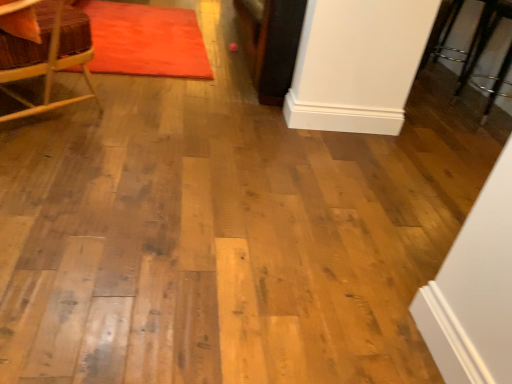
Measure the distance between point (x=28, y=61) and camera.

Point (x=28, y=61) and camera are 5.83 feet apart from each other.

What do you see at coordinates (46, 52) in the screenshot? This screenshot has height=384, width=512. I see `wooden chair at left` at bounding box center [46, 52].

You are a GUI agent. You are given a task and a screenshot of the screen. Output one action in this format:
    pyautogui.click(x=<x>, y=<y>)
    Task: Click on the wooden chair at left
    
    Given the screenshot: What is the action you would take?
    pyautogui.click(x=46, y=52)

This screenshot has height=384, width=512. What do you see at coordinates (146, 40) in the screenshot?
I see `velvet orange mat at upper left` at bounding box center [146, 40].

The height and width of the screenshot is (384, 512). Find the location of `velvet orange mat at upper left`. velvet orange mat at upper left is located at coordinates (146, 40).

Measure the distance between point (134, 63) and camera.

2.75 meters.

Where is `wooden chair at left`? The width and height of the screenshot is (512, 384). wooden chair at left is located at coordinates (46, 52).

Would you say wooden chair at left is to the left or to the right of velvet orange mat at upper left in the picture?

In the image, wooden chair at left appears on the left side of velvet orange mat at upper left.

Considering the relative positions of wooden chair at left and velvet orange mat at upper left in the image provided, is wooden chair at left behind velvet orange mat at upper left?

That is False.

Does point (83, 51) come farther from viewer compared to point (106, 59)?

No, it is in front of (106, 59).

From the image's perspective, is wooden chair at left positioned above or below velvet orange mat at upper left?

From the image's perspective, wooden chair at left appears below velvet orange mat at upper left.

From a real-world perspective, which object stands above the other?

wooden chair at left, from a real-world perspective.

In the scene shown: Between wooden chair at left and velvet orange mat at upper left, which one has larger width?

With larger width is velvet orange mat at upper left.

Which of these two, wooden chair at left or velvet orange mat at upper left, stands shorter?

velvet orange mat at upper left is shorter.

Is wooden chair at left bigger than velvet orange mat at upper left?

Indeed, wooden chair at left has a larger size compared to velvet orange mat at upper left.

Is wooden chair at left not within velvet orange mat at upper left?

Yes.

Is wooden chair at left next to velvet orange mat at upper left?

wooden chair at left and velvet orange mat at upper left are not in contact.

Is wooden chair at left turned away from velvet orange mat at upper left?

No, wooden chair at left is not facing the opposite direction of velvet orange mat at upper left.

How far apart are wooden chair at left and velvet orange mat at upper left?

wooden chair at left and velvet orange mat at upper left are 38.11 inches apart from each other.

The image size is (512, 384). In order to click on mat located underneath the wooden chair at left (from a real-world perspective) in this screenshot , I will do `click(146, 40)`.

Which object is positioned more to the right, velvet orange mat at upper left or wooden chair at left?

velvet orange mat at upper left.

Consider the image. Is the depth of velvet orange mat at upper left greater than that of wooden chair at left?

Yes, it is.

Is point (198, 63) closer or farther from the camera than point (58, 24)?

Point (198, 63) appears to be farther away from the viewer than point (58, 24).

From the image's perspective, relative to wooden chair at left, is velvet orange mat at upper left above or below?

From the image's perspective, velvet orange mat at upper left appears above wooden chair at left.

From a real-world perspective, does velvet orange mat at upper left sit lower than wooden chair at left?

Yes.

Is velvet orange mat at upper left wider than wooden chair at left?

Yes.

From their relative heights in the image, would you say velvet orange mat at upper left is taller or shorter than wooden chair at left?

In the image, velvet orange mat at upper left appears to be shorter than wooden chair at left.

Can you confirm if velvet orange mat at upper left is smaller than wooden chair at left?

Yes, velvet orange mat at upper left is smaller than wooden chair at left.

Which is correct: velvet orange mat at upper left is inside wooden chair at left, or outside of it?

The correct answer is: outside.

Is velvet orange mat at upper left not close to wooden chair at left?

That's not correct — velvet orange mat at upper left is a little close to wooden chair at left.

Is velvet orange mat at upper left looking in the opposite direction of wooden chair at left?

No, velvet orange mat at upper left is not facing away from wooden chair at left.

In the image, there is a velvet orange mat at upper left. What are the coordinates of `chair below it (from the image's perspective)` in the screenshot? It's located at (46, 52).

This screenshot has width=512, height=384. I want to click on mat on the right of wooden chair at left, so click(x=146, y=40).

Locate an element on the screen. The image size is (512, 384). chair above the velvet orange mat at upper left (from a real-world perspective) is located at coordinates [x=46, y=52].